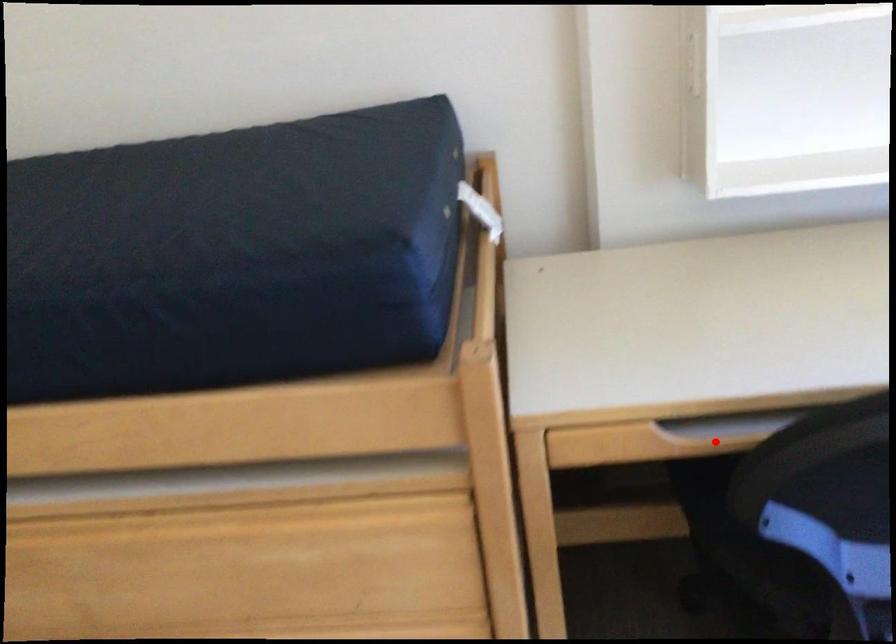
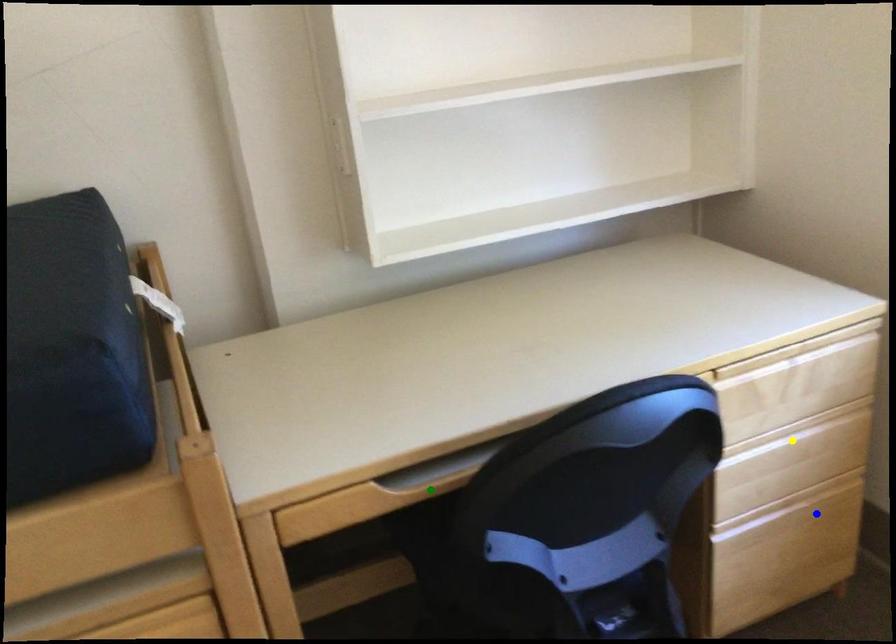
Question: I am providing you with two images of the same scene from different viewpoints. A red point is marked on the first image. You are given multiple points on the second image. Can you choose the point in image 2 that corresponds to the point in image 1?

Choices:
 (A) blue point
 (B) yellow point
 (C) green point

Answer: (C)